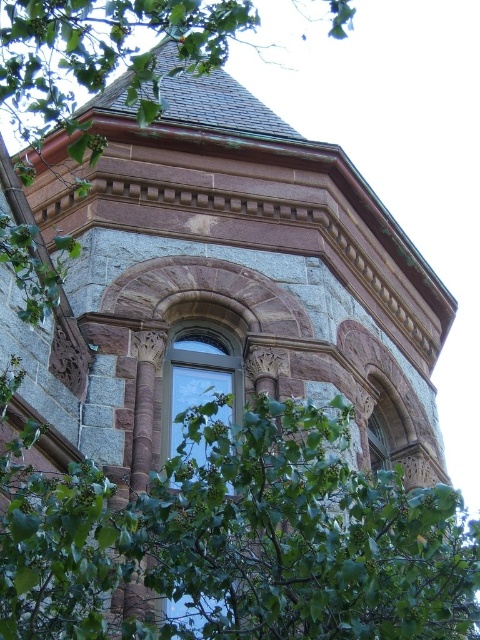
Question: Is green leafy tree at center behind clear glass window at center?

Choices:
 (A) no
 (B) yes

Answer: (A)

Question: Among these objects, which one is farthest from the camera?

Choices:
 (A) clear glass window at center
 (B) green leafy tree at center

Answer: (A)

Question: Does green leafy tree at center come in front of clear glass window at center?

Choices:
 (A) yes
 (B) no

Answer: (A)

Question: Among these objects, which one is nearest to the camera?

Choices:
 (A) clear glass window at center
 (B) green leafy tree at center

Answer: (B)

Question: Does green leafy tree at center lie in front of clear glass window at center?

Choices:
 (A) no
 (B) yes

Answer: (B)